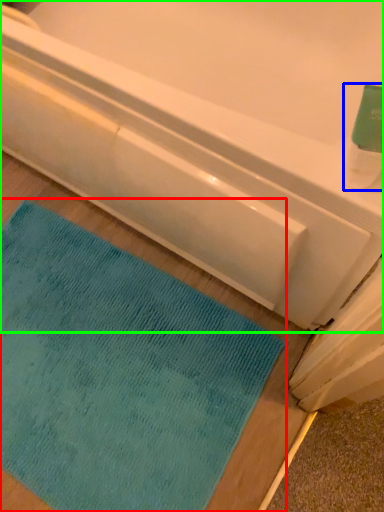
Question: Based on their relative distances, which object is farther from mat (highlighted by a red box)? Choose from cleaning product (highlighted by a blue box) and bathtub (highlighted by a green box).

Choices:
 (A) cleaning product
 (B) bathtub

Answer: (A)